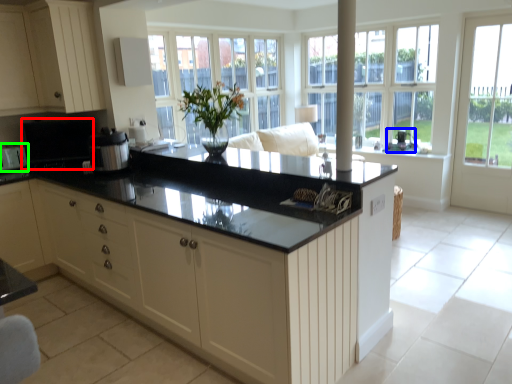
Question: Which object is positioned farthest from appliance (highlighted by a red box)? Select from appliance (highlighted by a blue box) and appliance (highlighted by a green box).

Choices:
 (A) appliance
 (B) appliance

Answer: (A)